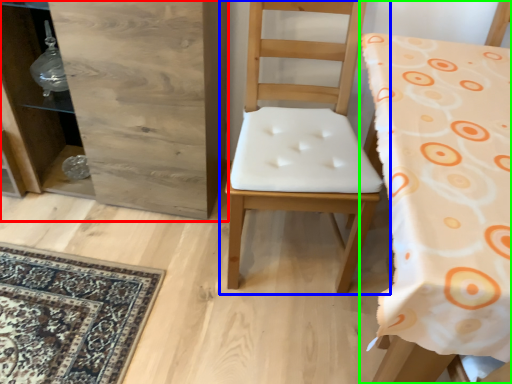
Question: Which is farther away from dresser (highlighted by a red box)? chair (highlighted by a blue box) or chair (highlighted by a green box)?

Choices:
 (A) chair
 (B) chair

Answer: (B)